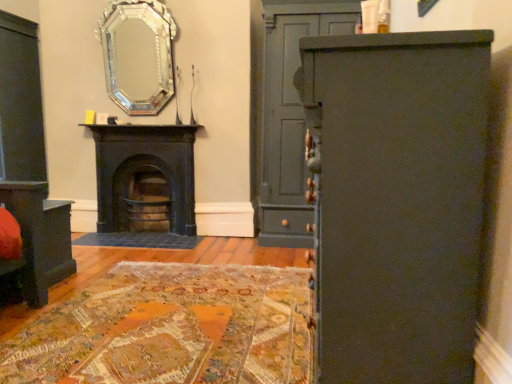
Question: Is silver/glass mirror at upper center bigger than matte gray cabinet at right?

Choices:
 (A) yes
 (B) no

Answer: (B)

Question: Can you confirm if silver/glass mirror at upper center is thinner than matte gray cabinet at right?

Choices:
 (A) yes
 (B) no

Answer: (A)

Question: Does silver/glass mirror at upper center appear on the left side of matte gray cabinet at right?

Choices:
 (A) yes
 (B) no

Answer: (A)

Question: Is silver/glass mirror at upper center far from matte gray cabinet at right?

Choices:
 (A) no
 (B) yes

Answer: (B)

Question: Is silver/glass mirror at upper center located outside matte gray cabinet at right?

Choices:
 (A) no
 (B) yes

Answer: (B)

Question: From a real-world perspective, is matte black cabinet at right physically located above or below silver/glass mirror at upper center?

Choices:
 (A) above
 (B) below

Answer: (B)

Question: Is matte black cabinet at right wider or thinner than silver/glass mirror at upper center?

Choices:
 (A) wide
 (B) thin

Answer: (A)

Question: Is matte black cabinet at right in front of or behind silver/glass mirror at upper center in the image?

Choices:
 (A) front
 (B) behind

Answer: (A)

Question: Is matte black cabinet at right inside the boundaries of silver/glass mirror at upper center, or outside?

Choices:
 (A) inside
 (B) outside

Answer: (B)

Question: Is point (117, 182) closer or farther from the camera than point (329, 8)?

Choices:
 (A) closer
 (B) farther

Answer: (B)

Question: From the image's perspective, relative to matte gray cabinet at right, is black cast iron fireplace at center above or below?

Choices:
 (A) above
 (B) below

Answer: (B)

Question: From a real-world perspective, is black cast iron fireplace at center positioned above or below matte gray cabinet at right?

Choices:
 (A) below
 (B) above

Answer: (A)

Question: Relative to matte gray cabinet at right, is black cast iron fireplace at center in front or behind?

Choices:
 (A) front
 (B) behind

Answer: (B)

Question: Visually, is matte black vanity at lower left positioned to the left or to the right of matte gray cabinet at right?

Choices:
 (A) left
 (B) right

Answer: (A)

Question: Does point (53, 211) appear closer or farther from the camera than point (288, 196)?

Choices:
 (A) farther
 (B) closer

Answer: (B)